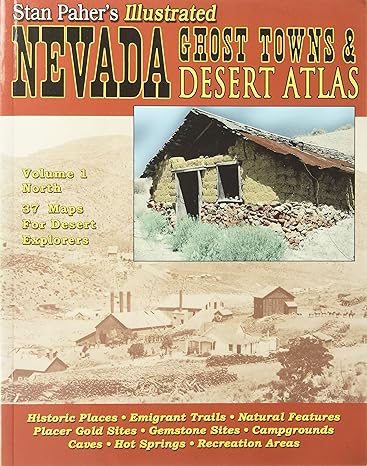
Identify the location of window. (230, 193), (193, 207), (244, 353), (232, 349).